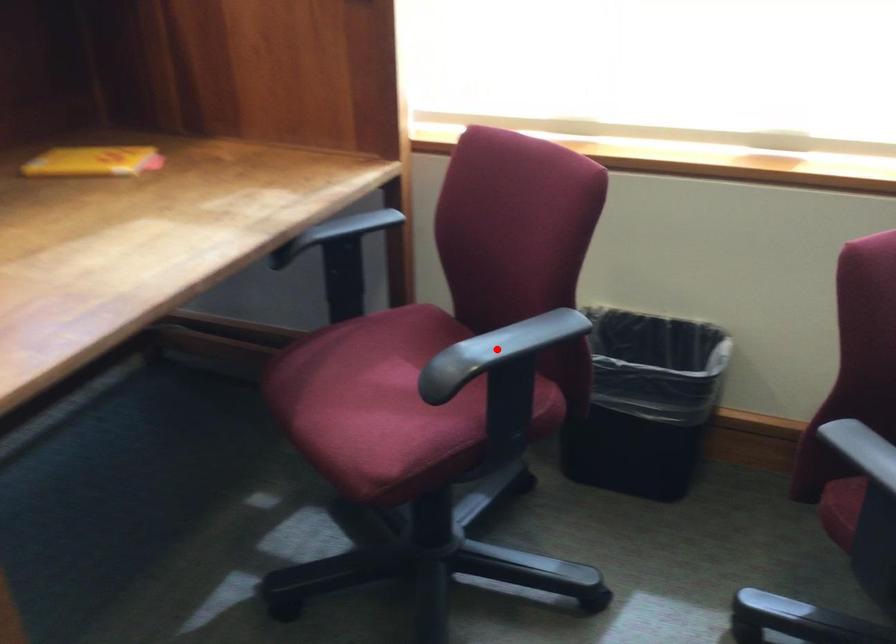
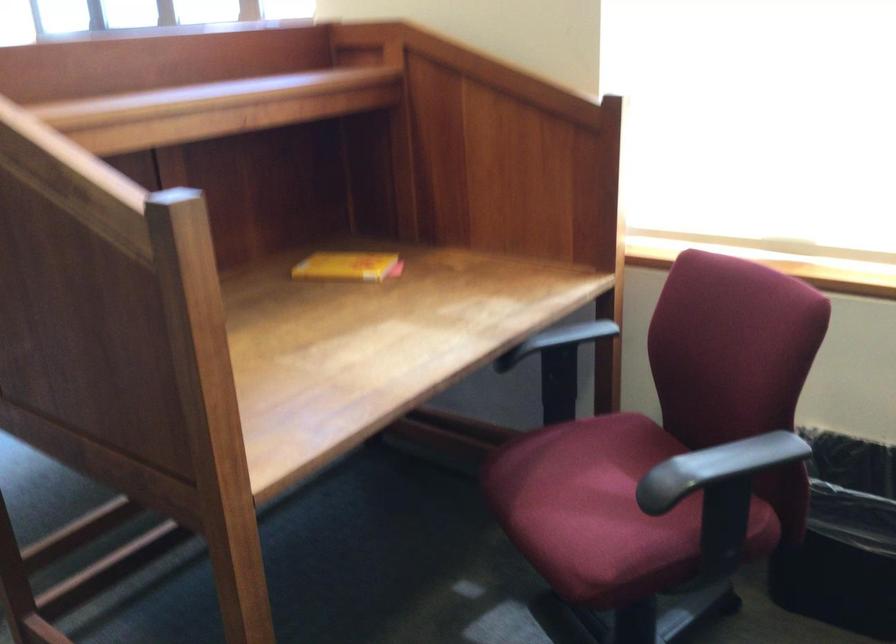
Where in the second image is the point corresponding to the highlighted location from the first image?

(716, 468)